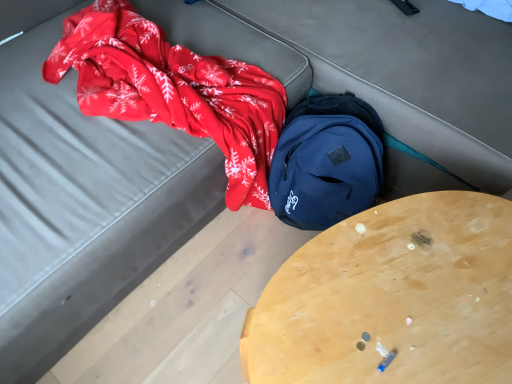
Identify the location of navy blue backpack at center. The height and width of the screenshot is (384, 512). (330, 161).

This screenshot has height=384, width=512. Describe the element at coordinates (330, 161) in the screenshot. I see `navy blue backpack at center` at that location.

Measure the distance between navy blue backpack at center and camera.

navy blue backpack at center is 3.83 feet from camera.

Locate an element on the screen. wooden table at center is located at coordinates (392, 298).

This screenshot has width=512, height=384. What do you see at coordinates (392, 298) in the screenshot?
I see `wooden table at center` at bounding box center [392, 298].

Locate an element on the screen. The height and width of the screenshot is (384, 512). navy blue backpack at center is located at coordinates (330, 161).

Considering the relative positions of navy blue backpack at center and wooden table at center in the image provided, is navy blue backpack at center to the left of wooden table at center from the viewer's perspective?

Yes, navy blue backpack at center is to the left of wooden table at center.

Which is in front, navy blue backpack at center or wooden table at center?

wooden table at center is in front.

Which is in front, point (338, 171) or point (490, 318)?

Point (490, 318)

From the image's perspective, is navy blue backpack at center located above or below wooden table at center?

Based on their image positions, navy blue backpack at center is located above wooden table at center.

In the scene shown: From a real-world perspective, is navy blue backpack at center above or below wooden table at center?

Clearly, from a real-world perspective, navy blue backpack at center is below wooden table at center.

Can you confirm if navy blue backpack at center is thinner than wooden table at center?

Indeed, navy blue backpack at center has a lesser width compared to wooden table at center.

Between navy blue backpack at center and wooden table at center, which one has less height?

navy blue backpack at center is shorter.

Between navy blue backpack at center and wooden table at center, which one has larger size?

wooden table at center.

Do you think navy blue backpack at center is within wooden table at center, or outside of it?

The correct answer is: outside.

Is navy blue backpack at center beside wooden table at center?

No, navy blue backpack at center is not touching wooden table at center.

Is navy blue backpack at center turned away from wooden table at center?

navy blue backpack at center does not have its back to wooden table at center.

How many degrees apart are the facing directions of navy blue backpack at center and wooden table at center?

66.8 degrees.

You are a GUI agent. You are given a task and a screenshot of the screen. Output one action in this format:
    pyautogui.click(x=<x>, y=<y>)
    Task: Click on the backpack behind the wooden table at center
    Image resolution: width=512 pixels, height=384 pixels.
    Given the screenshot: What is the action you would take?
    pyautogui.click(x=330, y=161)

Between wooden table at center and navy blue backpack at center, which one appears on the left side from the viewer's perspective?

navy blue backpack at center.

Is the position of wooden table at center less distant than that of navy blue backpack at center?

Yes, it is in front of navy blue backpack at center.

Which is in front, point (467, 212) or point (362, 167)?

Point (467, 212)

From the image's perspective, is wooden table at center located above navy blue backpack at center?

No, from the image's perspective, wooden table at center is not on top of navy blue backpack at center.

From a real-world perspective, relative to navy blue backpack at center, is wooden table at center vertically above or below?

In terms of real-world spatial position, wooden table at center is above navy blue backpack at center.

Considering the sizes of wooden table at center and navy blue backpack at center in the image, is wooden table at center wider or thinner than navy blue backpack at center?

Considering their sizes, wooden table at center looks broader than navy blue backpack at center.

Does wooden table at center have a greater height compared to navy blue backpack at center?

Correct, wooden table at center is much taller as navy blue backpack at center.

In terms of size, does wooden table at center appear bigger or smaller than navy blue backpack at center?

A: Considering their sizes, wooden table at center takes up more space than navy blue backpack at center.

Choose the correct answer: Is wooden table at center inside navy blue backpack at center or outside it?

wooden table at center is outside navy blue backpack at center.

Is wooden table at center placed right next to navy blue backpack at center?

No.

Is navy blue backpack at center at the back of wooden table at center?

Yes, wooden table at center's orientation is away from navy blue backpack at center.

Measure the distance from wooden table at center to navy blue backpack at center.

wooden table at center is 16.33 inches from navy blue backpack at center.

In order to click on backpack directly beneath the wooden table at center (from a real-world perspective) in this screenshot , I will do `click(330, 161)`.

Where is `backpack above the wooden table at center (from the image's perspective)`? The image size is (512, 384). backpack above the wooden table at center (from the image's perspective) is located at coordinates (330, 161).

The height and width of the screenshot is (384, 512). I want to click on backpack below the wooden table at center (from a real-world perspective), so click(330, 161).